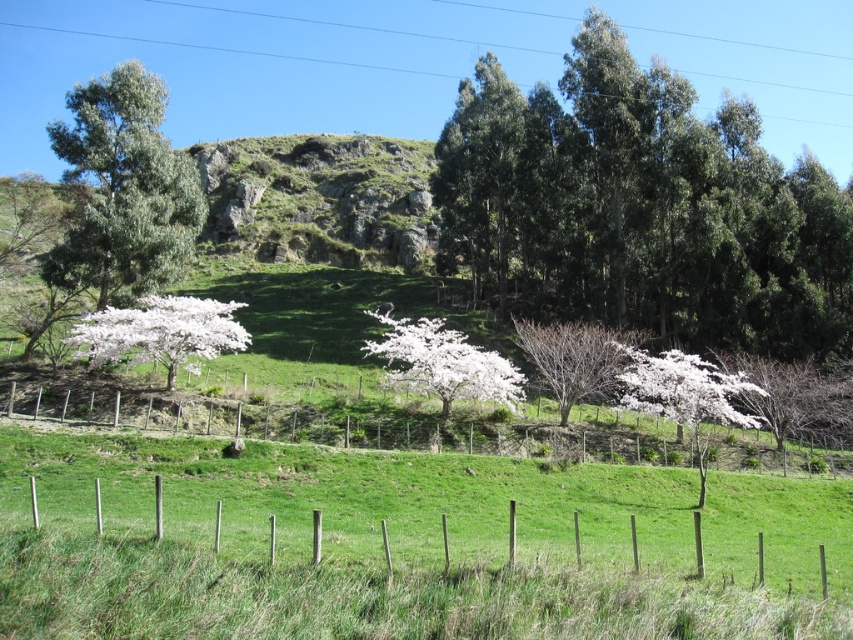
You are standing in the middle of the grassy field and want to walk towards the white blossoms at lower right. Which direction should you walk relative to the wooden post fence at lower center?

You should walk to the right of the wooden post fence at lower center because the white blossoms at lower right are located to the right of the fence.

You are a painter setting up your easel in the middle of the grassy field. You want to paint both the wooden post fence at lower center and the white blossoms at lower right. Which object will require you to use more horizontal space on your canvas?

The wooden post fence at lower center will require more horizontal space on the canvas because its width surpasses that of the white blossoms at lower right.

You are standing at the center of the grassy field and want to take a photo of the green leafy tree at left. In which direction should you point your camera to capture it?

The green leafy tree at left is located at the coordinates (123,189), so you should point your camera to the left side of the scene to capture it.